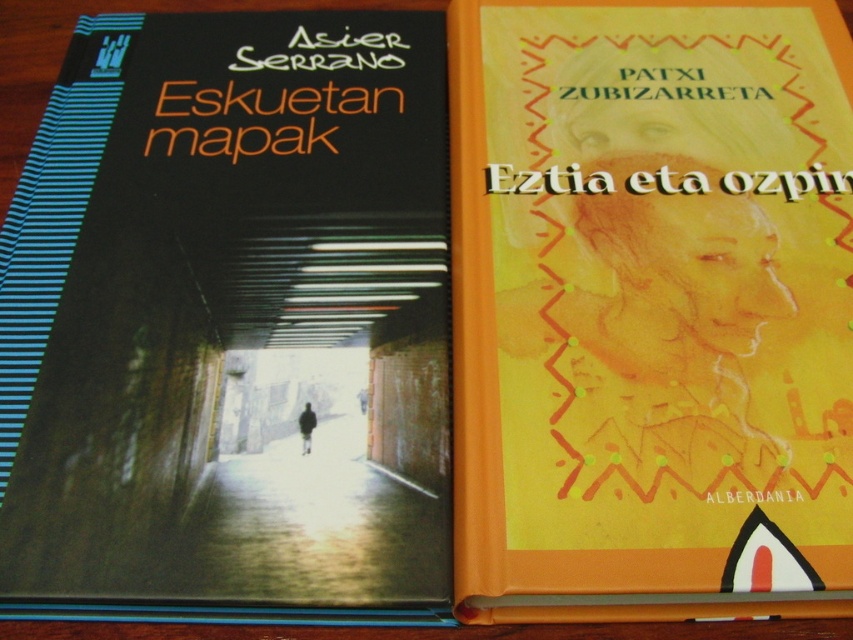
What is the exact position of the black matte book cover at center in the image?

The black matte book cover at center is located at point coordinates of (230, 324).

You are organizing a bookshelf and need to place both the black matte book cover at center and the orange matte book at right. If the shelf has a space that can only fit the narrower book, which book should you place there?

The black matte book cover at center should be placed in the narrower space since its width is less than the orange matte book at right.

You are organizing a bookshelf and need to place the black matte book cover at center and the orange matte book at right. Since the shelf has limited vertical space, which book should you place first to ensure both fit vertically?

The black matte book cover at center is not as tall as the orange matte book at right, so you should place the orange matte book at right first to accommodate its greater height before placing the shorter black matte book cover at center.